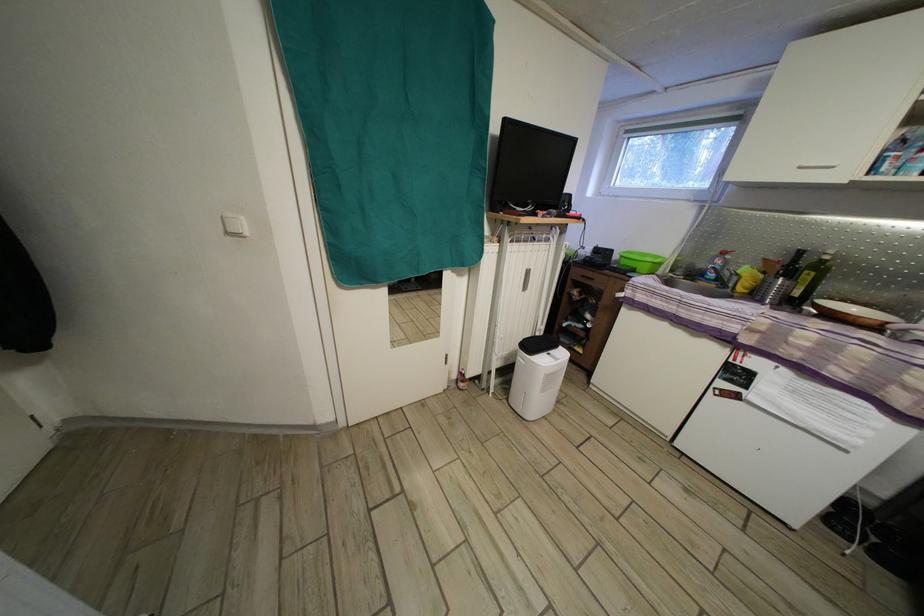
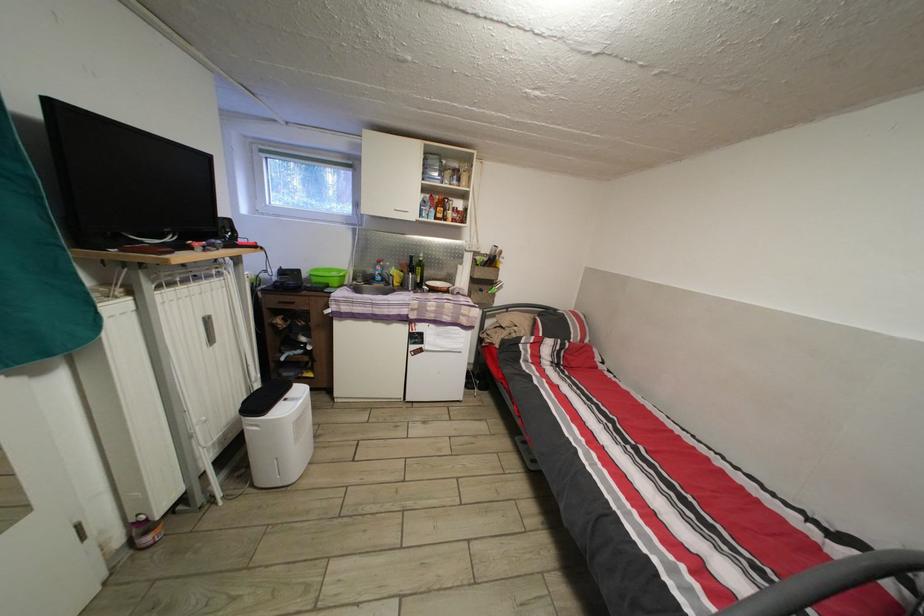
Locate, in the second image, the point that corresponds to the point at 622,262 in the first image.

(311, 282)